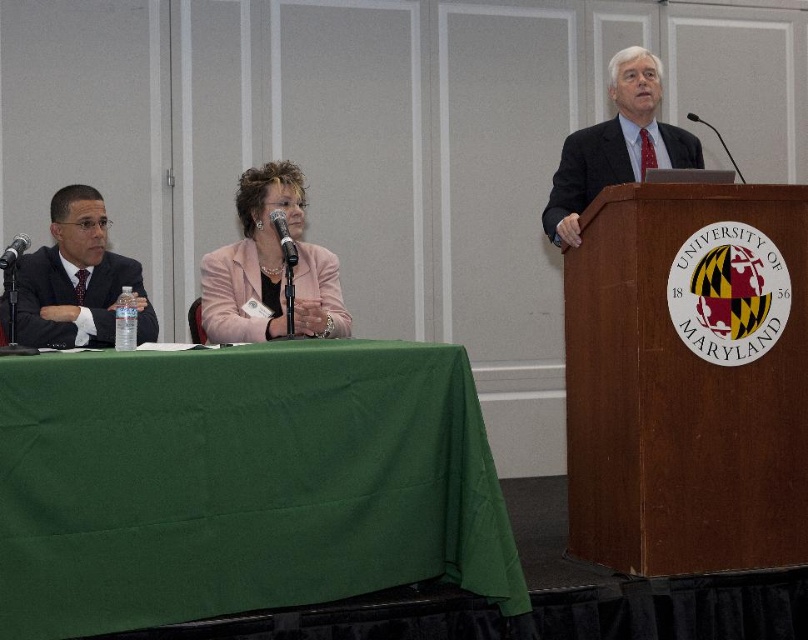
Question: Can you confirm if green fabric table at lower left is positioned to the left of metallic silver microphone at center?

Choices:
 (A) no
 (B) yes

Answer: (A)

Question: Which point is closer to the camera?

Choices:
 (A) black plastic microphone at upper right
 (B) metallic silver microphone at center
 (C) dark suit at right

Answer: (B)

Question: Estimate the real-world distances between objects in this image. Which object is closer to the pink fabric jacket at center?

Choices:
 (A) matte black suit at left
 (B) metallic silver microphone at left
 (C) green fabric table at lower left

Answer: (A)

Question: Does green fabric table at lower left have a smaller size compared to dark suit at right?

Choices:
 (A) no
 (B) yes

Answer: (A)

Question: Which point is farther to the camera?

Choices:
 (A) (53, 440)
 (B) (739, 172)
 (C) (0, 262)
 (D) (247, 198)

Answer: (B)

Question: Can you confirm if dark suit at right is positioned above black plastic microphone at upper right?

Choices:
 (A) no
 (B) yes

Answer: (A)